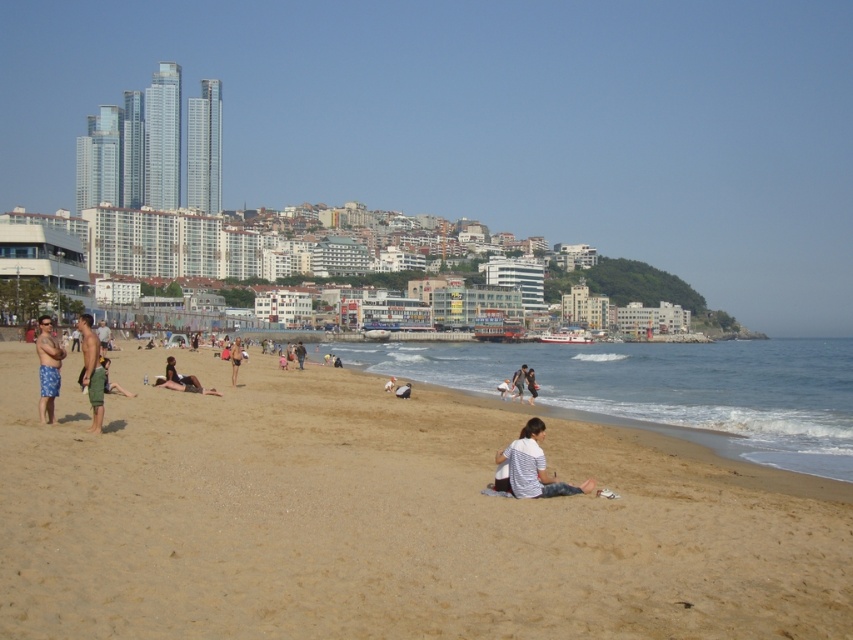
You are standing on the beach and want to retrieve your white cotton shirt at center. Given that you can walk 3 feet per second, how many seconds will it take you to reach it?

The white cotton shirt at center is 305.72 feet away from viewer. At a walking speed of 3 feet per second, it would take approximately 101.9 seconds to reach it.

You are a photographer standing at the shoreline. You want to take a photo of the white cotton shirt at center and the dark gray fabric pants at lower center. If your camera has a maximum focus range of 4 meters, will both subjects be in focus?

The white cotton shirt at center is 4.32 meters away from the dark gray fabric pants at lower center. Since the camera can only focus up to 4 meters, the distance between them exceeds the maximum range. Therefore, both subjects cannot be in focus simultaneously.

You are a photographer standing at the edge of the beach, aiming to capture a photo that includes both the white striped shirt at center and the dark gray fabric pants at lower center. Given their distance apart, will you need to adjust your camera lens to a wider angle to ensure both are in frame?

The white striped shirt at center and dark gray fabric pants at lower center are 32.41 meters apart. To capture both in the same frame, you would need to use a wider angle lens to accommodate the distance between them.